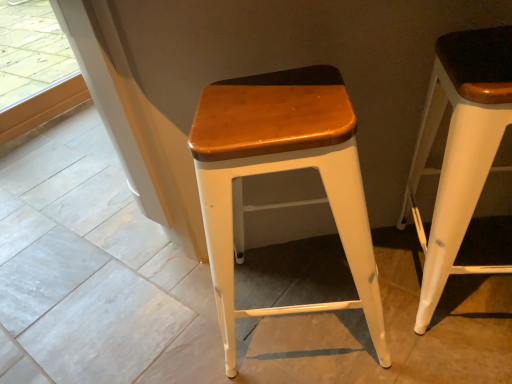
At what (x,y) coordinates should I click in order to perform the action: click on vacant space situated above white matte wood stool at right, positioned as the 1th stool in right-to-left order (from a real-world perspective). Please return your answer as a coordinate pair (x, y). Looking at the image, I should click on click(x=481, y=53).